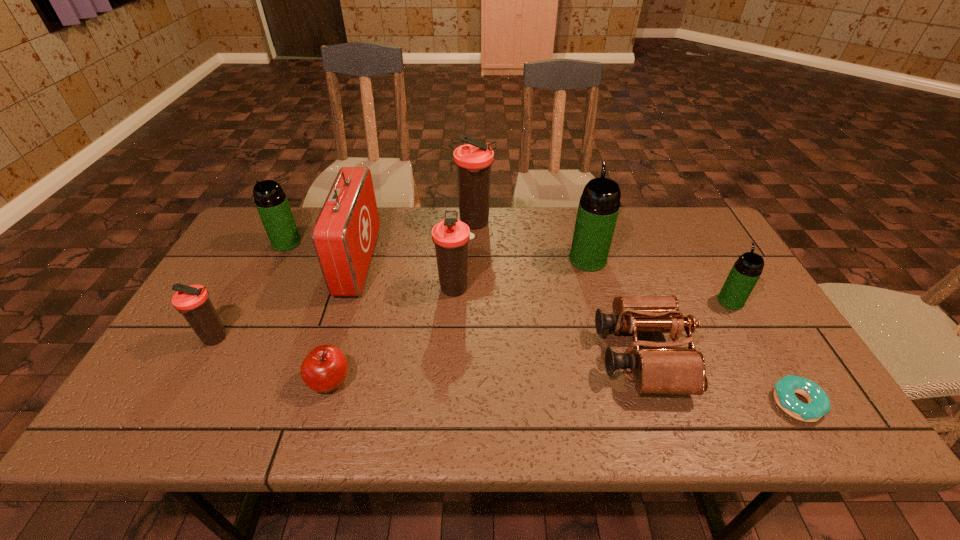
The image size is (960, 540). What are the coordinates of `green thermos bottle that stands as the closest to the fifth thermos bottle from left to right` in the screenshot? It's located at (746, 271).

Point out which green thermos bottle is positioned as the second nearest to the rightmost thermos bottle. Please provide its 2D coordinates. Your answer should be formatted as a tuple, i.e. [(x, y)], where the tuple contains the x and y coordinates of a point satisfying the conditions above.

[(271, 202)]

You are a GUI agent. You are given a task and a screenshot of the screen. Output one action in this format:
    pyautogui.click(x=<x>, y=<y>)
    Task: Click on the vacant position in the image that satisfies the following two spatial constraints: 1. from the spout of the leftmost green thermos bottle; 2. on the right side of the shortest object
    Image resolution: width=960 pixels, height=540 pixels.
    Given the screenshot: What is the action you would take?
    pyautogui.click(x=204, y=403)

The image size is (960, 540). Find the location of `free spot that satisfies the following two spatial constraints: 1. through the eyepieces of the binoculars; 2. on the back side of the shortest object`. free spot that satisfies the following two spatial constraints: 1. through the eyepieces of the binoculars; 2. on the back side of the shortest object is located at coordinates (657, 403).